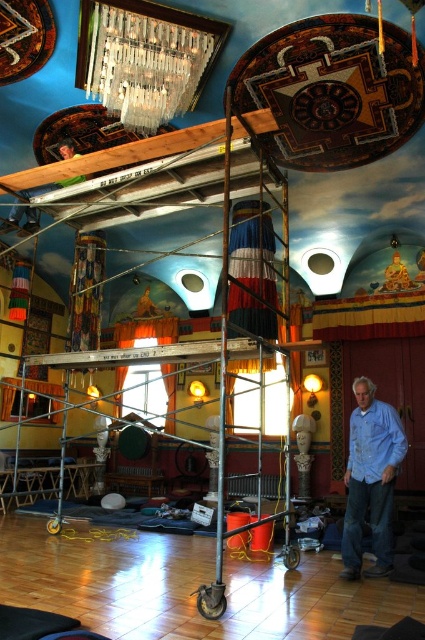
You are a decorator checking the room layout. The metallic glass chandelier at upper center and the blue denim jeans at lower right are both in your view. Which object is taller?

The blue denim jeans at lower right is taller than the metallic glass chandelier at upper center according to the description.